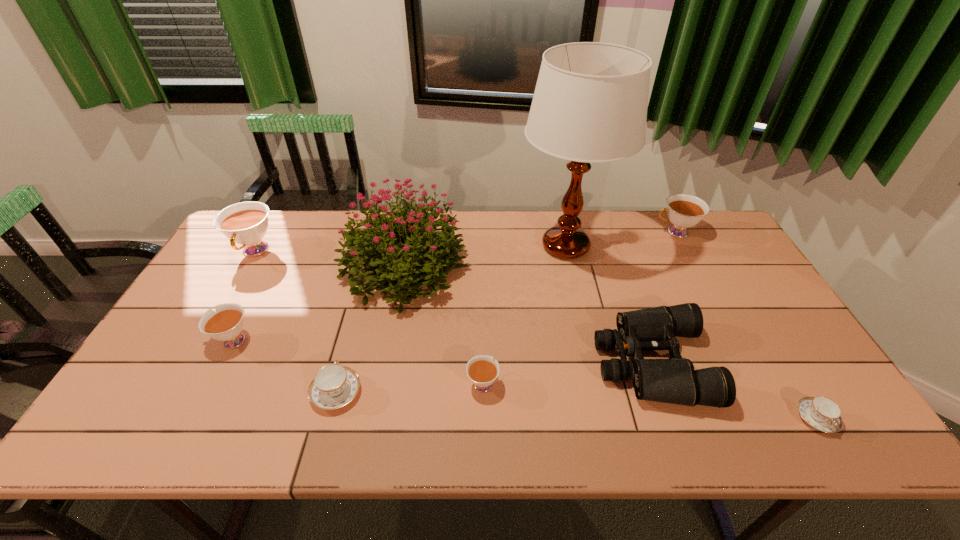
Where is `free space located on the side of the third white teacup from left to right with the handle`? This screenshot has width=960, height=540. free space located on the side of the third white teacup from left to right with the handle is located at coordinates (482, 299).

The height and width of the screenshot is (540, 960). I want to click on free space located 0.260m on the side with the handle of the bigger blue teacup, so click(362, 296).

Locate an element on the screen. blank space located 0.220m on the side with the handle of the bigger blue teacup is located at coordinates (359, 307).

The width and height of the screenshot is (960, 540). Find the location of `free space located 0.340m on the side with the handle of the bigger blue teacup`. free space located 0.340m on the side with the handle of the bigger blue teacup is located at coordinates (368, 278).

Image resolution: width=960 pixels, height=540 pixels. In order to click on table lamp that is at the far edge in this screenshot , I will do `click(590, 103)`.

The width and height of the screenshot is (960, 540). Identify the location of bouquet located at the far edge. (426, 249).

The image size is (960, 540). I want to click on binoculars at the near edge, so click(674, 380).

This screenshot has height=540, width=960. Identify the location of object present at the far left corner. (245, 223).

Locate an element on the screen. object positioned at the far right corner is located at coordinates (684, 211).

Locate an element on the screen. object at the near right corner is located at coordinates (823, 414).